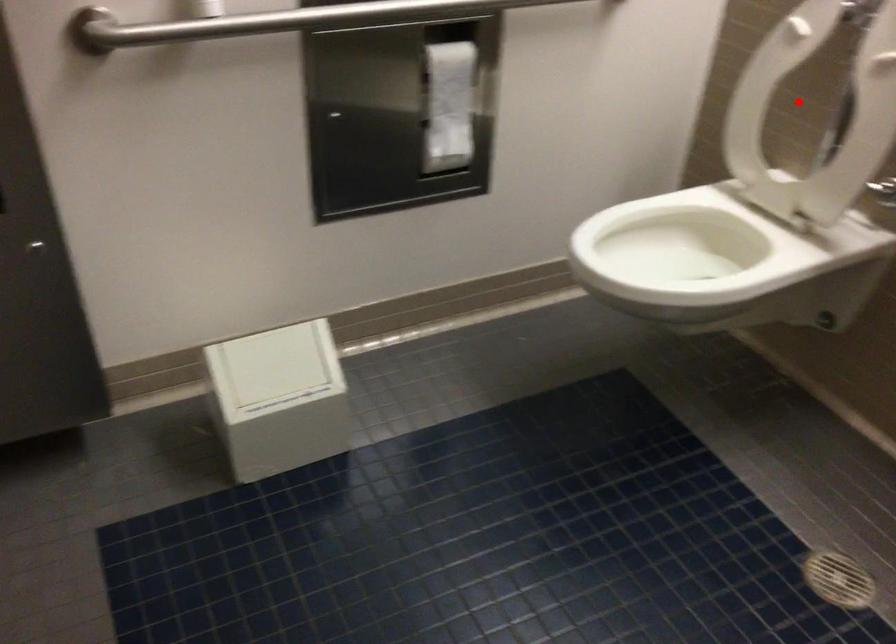
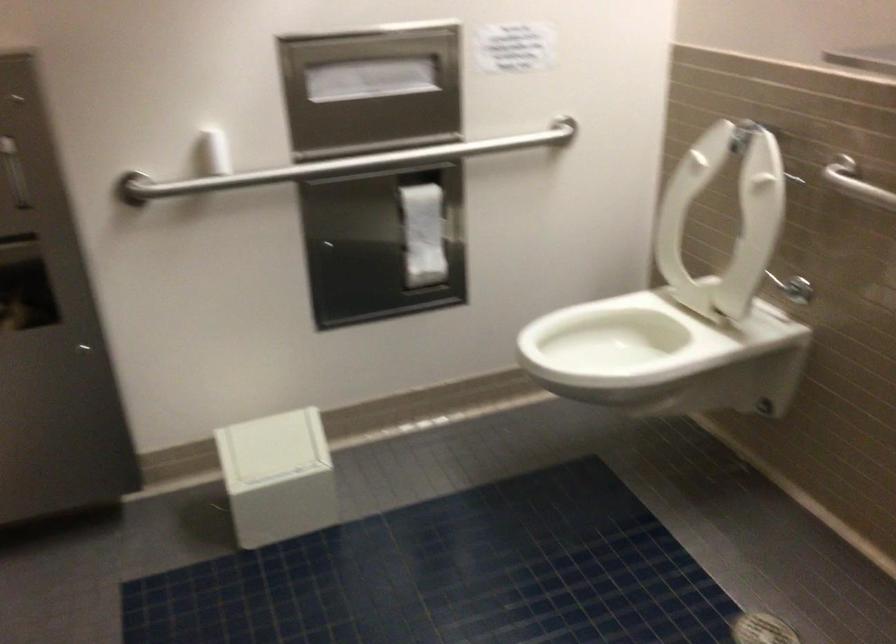
Question: I am providing you with two images of the same scene from different viewpoints. Image1 has a red point marked. In image2, the corresponding 3D location appears at what relative position? Reply with the corresponding letter.

Choices:
 (A) Closer
 (B) Farther

Answer: (B)